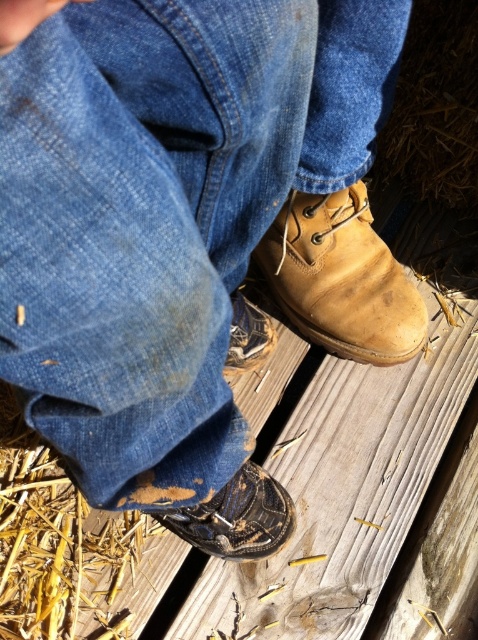
You are a delivery robot that is 18 inches wide. You need to pass between the leather boot at lower center and the edge of the wooden platform to reach the delivery point. Is there enough space for you to move through?

The distance between the leather boot at lower center and the viewer is 36.25 inches. Since the robot is 18 inches wide, there is sufficient space for the robot to pass through as the available width is double the robot width.

You are standing on the wooden platform and want to place a small tool between the two points, point (365,330) and point (219,502). Which point is closer to you so you can reach it first?

Point (365,330) is closer to you than point (219,502), so you can reach it first.

You are standing on the wooden deck and want to move from one point to another. Which point, point [261,556] or point [258,337], is closer to you?

Point [261,556] is closer to the viewer than point [258,337].